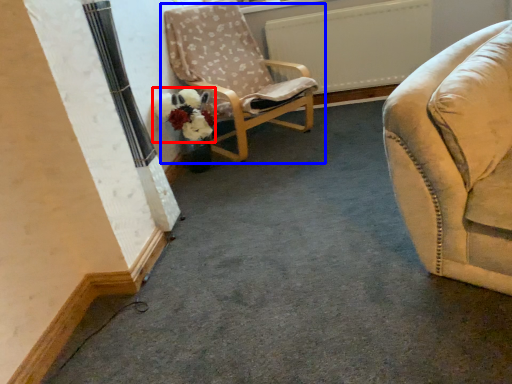
Question: Which object is closer to the camera taking this photo, flower (highlighted by a red box) or chair (highlighted by a blue box)?

Choices:
 (A) flower
 (B) chair

Answer: (B)